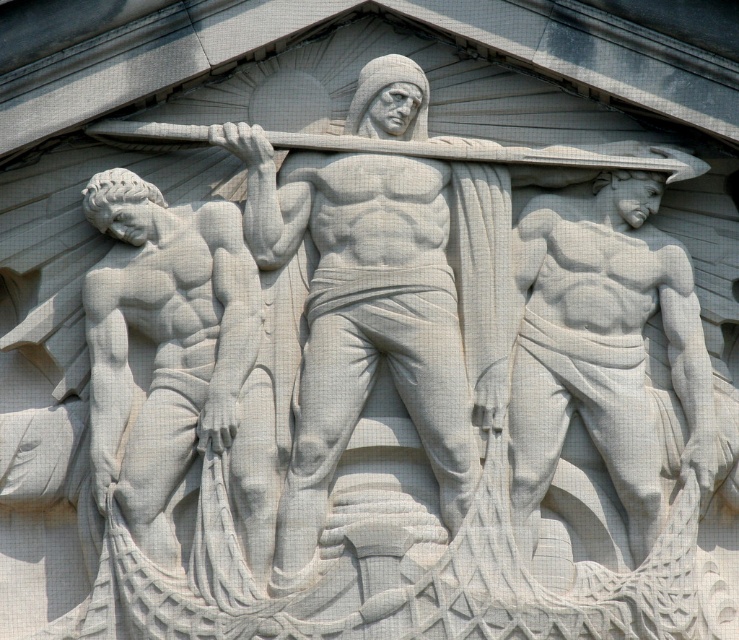
Can you confirm if smooth white statue at left is positioned to the right of matte white statue at right?

Incorrect, smooth white statue at left is not on the right side of matte white statue at right.

Between point (222, 257) and point (602, 192), which one is positioned behind?

The point (602, 192) is behind.

Find the location of a particular element. The image size is (739, 640). smooth white statue at left is located at coordinates (177, 360).